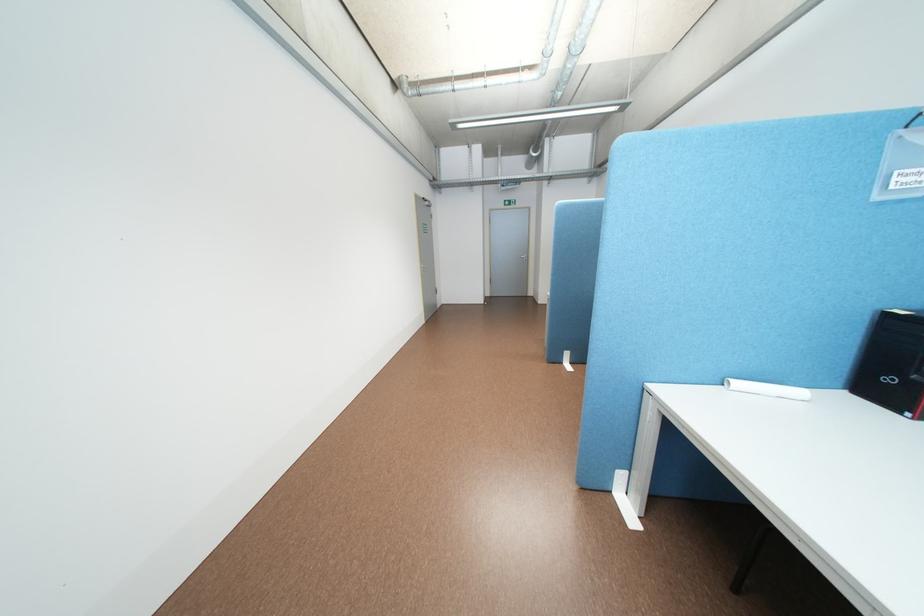
Where is `silver door handle`? The height and width of the screenshot is (616, 924). silver door handle is located at coordinates (523, 256).